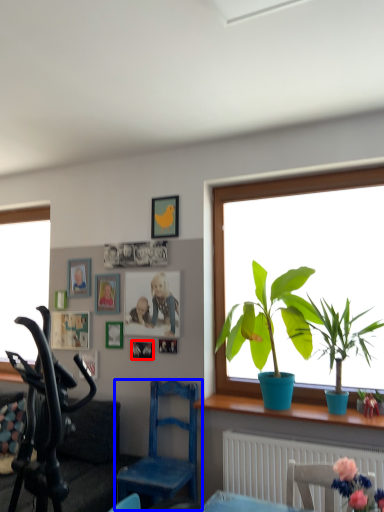
Question: Which object appears closest to the camera in this image, picture frame (highlighted by a red box) or chair (highlighted by a blue box)?

Choices:
 (A) picture frame
 (B) chair

Answer: (B)